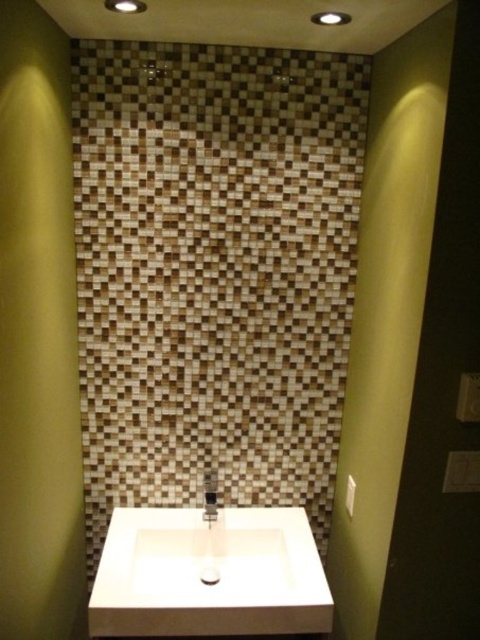
Question: Which point appears closest to the camera in this image?

Choices:
 (A) (178, 593)
 (B) (297, 412)
 (C) (215, 516)

Answer: (A)

Question: Is the position of brown mosaic tile at center more distant than that of satin nickel faucet at center?

Choices:
 (A) no
 (B) yes

Answer: (A)

Question: Is brown mosaic tile at center positioned behind satin nickel faucet at center?

Choices:
 (A) no
 (B) yes

Answer: (A)

Question: Estimate the real-world distances between objects in this image. Which object is closer to the white matte sink at center?

Choices:
 (A) satin nickel faucet at center
 (B) brown mosaic tile at center

Answer: (A)

Question: Among these points, which one is farthest from the camera?

Choices:
 (A) (210, 506)
 (B) (180, 392)
 (C) (230, 561)

Answer: (A)

Question: In this image, where is brown mosaic tile at center located relative to white matte sink at center?

Choices:
 (A) right
 (B) left

Answer: (B)